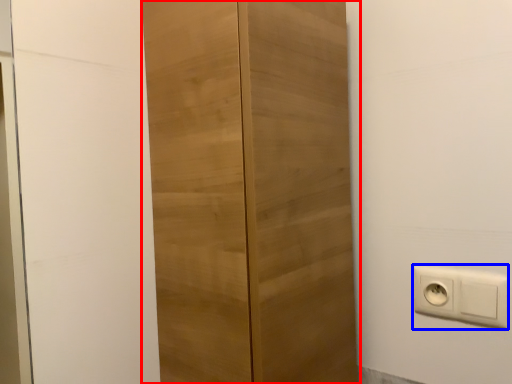
Question: Among these objects, which one is nearest to the camera, cupboard (highlighted by a red box) or power plugs and sockets (highlighted by a blue box)?

Choices:
 (A) cupboard
 (B) power plugs and sockets

Answer: (A)